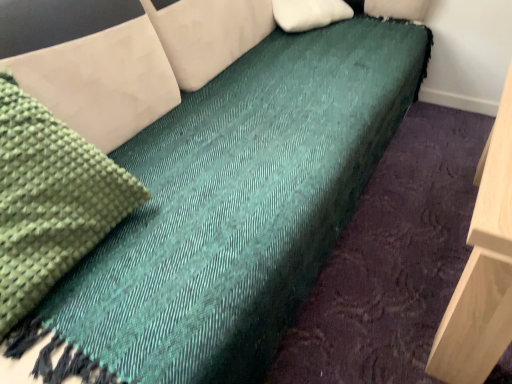
In order to face green knitted fabric at left, should I rotate leftwards or rightwards?

You should look left and rotate roughly 30.710 degrees.

Image resolution: width=512 pixels, height=384 pixels. Find the location of `green knitted fabric at left`. green knitted fabric at left is located at coordinates (50, 200).

The width and height of the screenshot is (512, 384). Describe the element at coordinates (50, 200) in the screenshot. I see `green knitted fabric at left` at that location.

This screenshot has height=384, width=512. Describe the element at coordinates (309, 13) in the screenshot. I see `white soft pillow at upper center` at that location.

Locate an element on the screen. white soft pillow at upper center is located at coordinates (309, 13).

The height and width of the screenshot is (384, 512). In order to click on green knitted fabric at left in this screenshot , I will do pos(50,200).

Is white soft pillow at upper center to the left of green knitted fabric at left from the viewer's perspective?

No, white soft pillow at upper center is not to the left of green knitted fabric at left.

Does white soft pillow at upper center lie in front of green knitted fabric at left?

No, the depth of white soft pillow at upper center is greater than that of green knitted fabric at left.

Between point (327, 3) and point (94, 227), which one is positioned behind?

The point (327, 3) is farther.

From the image's perspective, is white soft pillow at upper center above or below green knitted fabric at left?

Clearly, from the image's perspective, white soft pillow at upper center is above green knitted fabric at left.

Looking at this image, from a real-world perspective, is white soft pillow at upper center physically located above or below green knitted fabric at left?

white soft pillow at upper center is below green knitted fabric at left.

In terms of width, does white soft pillow at upper center look wider or thinner when compared to green knitted fabric at left?

Considering their sizes, white soft pillow at upper center looks broader than green knitted fabric at left.

From their relative heights in the image, would you say white soft pillow at upper center is taller or shorter than green knitted fabric at left?

Clearly, white soft pillow at upper center is shorter compared to green knitted fabric at left.

Consider the image. Is white soft pillow at upper center bigger or smaller than green knitted fabric at left?

white soft pillow at upper center is smaller than green knitted fabric at left.

Is white soft pillow at upper center located outside green knitted fabric at left?

Yes, white soft pillow at upper center is located beyond the bounds of green knitted fabric at left.

Does white soft pillow at upper center touch green knitted fabric at left?

No, white soft pillow at upper center is not beside green knitted fabric at left.

Is white soft pillow at upper center aimed at green knitted fabric at left?

No, white soft pillow at upper center is not oriented towards green knitted fabric at left.

Where is `material above the white soft pillow at upper center (from a real-world perspective)`? This screenshot has width=512, height=384. material above the white soft pillow at upper center (from a real-world perspective) is located at coordinates (50, 200).

Which is more to the left, green knitted fabric at left or white soft pillow at upper center?

green knitted fabric at left is more to the left.

Considering the positions of objects green knitted fabric at left and white soft pillow at upper center in the image provided, who is in front, green knitted fabric at left or white soft pillow at upper center?

green knitted fabric at left is closer to the camera.

Does point (48, 124) lie behind point (280, 17)?

No, (48, 124) is closer to viewer.

From the image's perspective, between green knitted fabric at left and white soft pillow at upper center, which one is located above?

white soft pillow at upper center is shown above in the image.

From a real-world perspective, is green knitted fabric at left above or below white soft pillow at upper center?

green knitted fabric at left is situated higher than white soft pillow at upper center in the real world.

In terms of width, does green knitted fabric at left look wider or thinner when compared to white soft pillow at upper center?

Considering their sizes, green knitted fabric at left looks slimmer than white soft pillow at upper center.

Which of these two, green knitted fabric at left or white soft pillow at upper center, stands shorter?

white soft pillow at upper center.

Between green knitted fabric at left and white soft pillow at upper center, which one has smaller size?

With smaller size is white soft pillow at upper center.

Is green knitted fabric at left located outside white soft pillow at upper center?

Indeed, green knitted fabric at left is completely outside white soft pillow at upper center.

Is green knitted fabric at left far away from white soft pillow at upper center?

Yes.

Is green knitted fabric at left oriented towards white soft pillow at upper center?

No, green knitted fabric at left is not aimed at white soft pillow at upper center.

What's the angular difference between green knitted fabric at left and white soft pillow at upper center's facing directions?

0.00135 degrees.

How far apart are green knitted fabric at left and white soft pillow at upper center?

green knitted fabric at left is 1.25 meters from white soft pillow at upper center.

I want to click on material in front of the white soft pillow at upper center, so click(50, 200).

In the image, there is a green knitted fabric at left. Identify the location of pillow above it (from the image's perspective). Image resolution: width=512 pixels, height=384 pixels. (309, 13).

The height and width of the screenshot is (384, 512). In order to click on material below the white soft pillow at upper center (from the image's perspective) in this screenshot , I will do `click(50, 200)`.